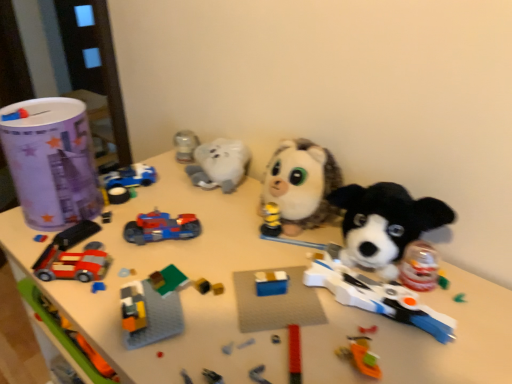
The width and height of the screenshot is (512, 384). I want to click on vacant space behind shiny plastic toy car at center, the fourth toy positioned from the left, so click(187, 191).